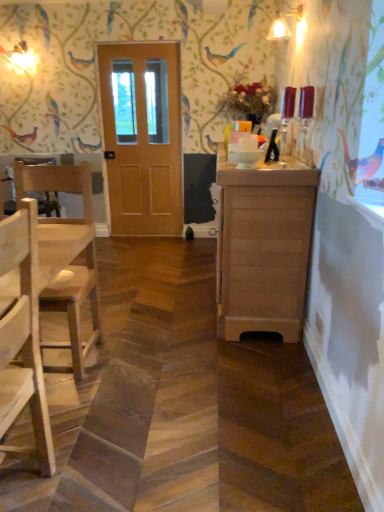
Question: Is the depth of wooden cabinet at right less than that of wooden door at center?

Choices:
 (A) yes
 (B) no

Answer: (A)

Question: From a real-world perspective, is wooden cabinet at right physically above wooden door at center?

Choices:
 (A) no
 (B) yes

Answer: (A)

Question: Can wooden door at center be found inside wooden cabinet at right?

Choices:
 (A) yes
 (B) no

Answer: (B)

Question: Considering the relative sizes of wooden cabinet at right and wooden door at center in the image provided, is wooden cabinet at right bigger than wooden door at center?

Choices:
 (A) yes
 (B) no

Answer: (A)

Question: Considering the relative sizes of wooden cabinet at right and wooden door at center in the image provided, is wooden cabinet at right smaller than wooden door at center?

Choices:
 (A) yes
 (B) no

Answer: (B)

Question: Considering the relative sizes of wooden cabinet at right and wooden door at center in the image provided, is wooden cabinet at right thinner than wooden door at center?

Choices:
 (A) yes
 (B) no

Answer: (B)

Question: From a real-world perspective, is wooden door at center beneath wooden cabinet at right?

Choices:
 (A) no
 (B) yes

Answer: (A)

Question: Is wooden door at center closer to camera compared to wooden cabinet at right?

Choices:
 (A) yes
 (B) no

Answer: (B)

Question: Does wooden door at center have a greater width compared to wooden cabinet at right?

Choices:
 (A) yes
 (B) no

Answer: (B)

Question: Does wooden door at center have a lesser height compared to wooden cabinet at right?

Choices:
 (A) no
 (B) yes

Answer: (A)

Question: Are wooden door at center and wooden cabinet at right beside each other?

Choices:
 (A) yes
 (B) no

Answer: (B)

Question: From the image's perspective, is wooden door at center located beneath wooden cabinet at right?

Choices:
 (A) no
 (B) yes

Answer: (A)

Question: Considering the relative sizes of wooden cabinet at right and natural wood chair at left, the 1th chair when ordered from back to front, in the image provided, is wooden cabinet at right wider than natural wood chair at left, the 1th chair when ordered from back to front,?

Choices:
 (A) yes
 (B) no

Answer: (B)